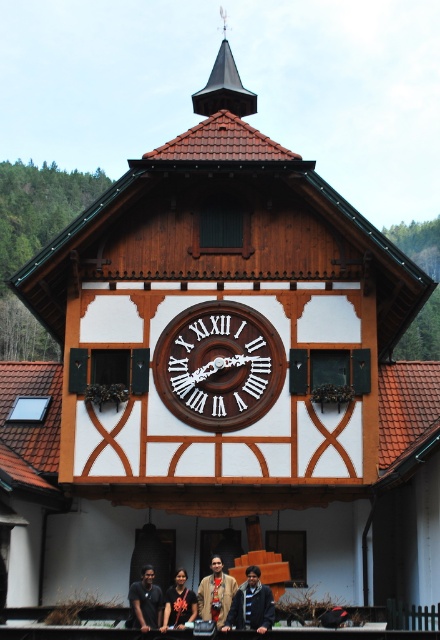
You are standing in front of the traditional wooden building and notice a dark blue jacket at lower center. Where would you look to find the wooden clock at center?

The wooden clock at center is located to the right of the dark blue jacket at lower center.

You are standing in front of the traditional wooden building and want to reach both the dark blue jacket at lower center and the dark brown shirt at center. Which one is closer to you?

The dark blue jacket at lower center is 3.96 meters away from the dark brown shirt at center. Since the dark brown shirt at center is closer to you than the dark blue jacket at lower center, you will reach the dark brown shirt at center first.